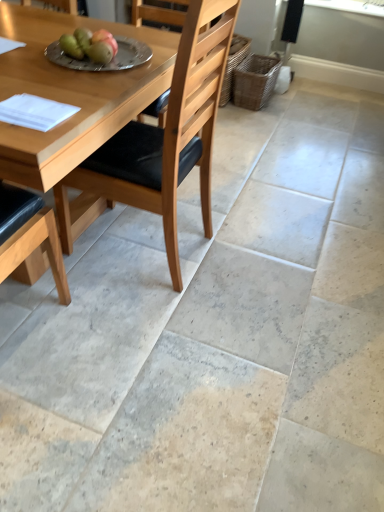
This screenshot has width=384, height=512. Identify the location of free point to the right of green matte pears at upper center, the second fruit from the left. (140, 64).